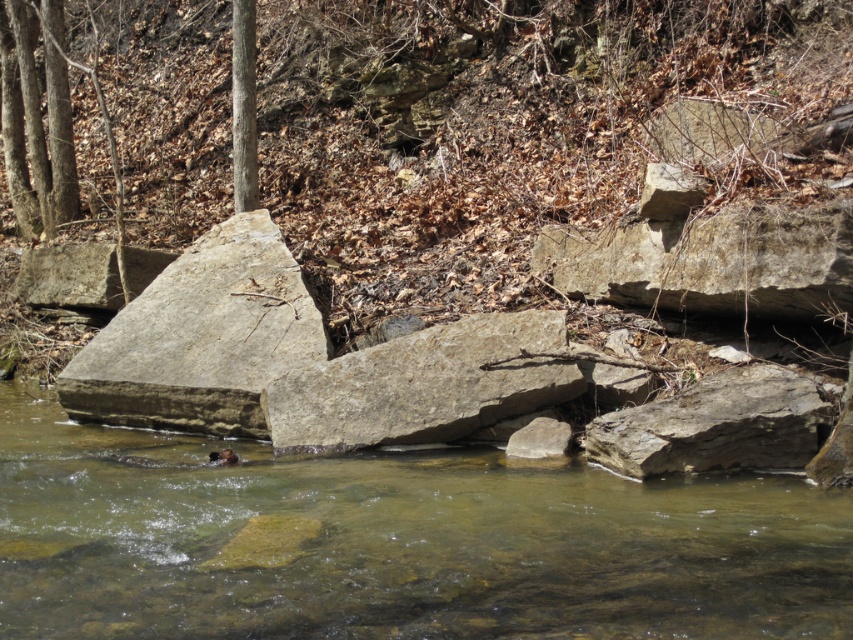
Can you confirm if brown rocky hillside at upper center is positioned to the left of clear water at center?

Yes, brown rocky hillside at upper center is to the left of clear water at center.

Can you confirm if brown rocky hillside at upper center is wider than clear water at center?

Yes.

Who is more forward, (802,132) or (479,557)?

Point (479,557)

At what (x,y) coordinates should I click in order to perform the action: click on brown rocky hillside at upper center. Please return your answer as a coordinate pair (x, y). This screenshot has height=640, width=853. Looking at the image, I should click on (521, 122).

Does clear water at center have a greater width compared to gray rough rock at lower right?

Correct, the width of clear water at center exceeds that of gray rough rock at lower right.

Identify the location of clear water at center. This screenshot has height=640, width=853. (395, 544).

Between point (155, 330) and point (596, 460), which one is positioned in front?

Positioned in front is point (596, 460).

Which is below, gray rough stone at center or gray rough rock at lower right?

gray rough rock at lower right is below.

I want to click on gray rough stone at center, so click(x=201, y=337).

Find the location of a particular element. This screenshot has height=640, width=853. gray rough stone at center is located at coordinates (201, 337).